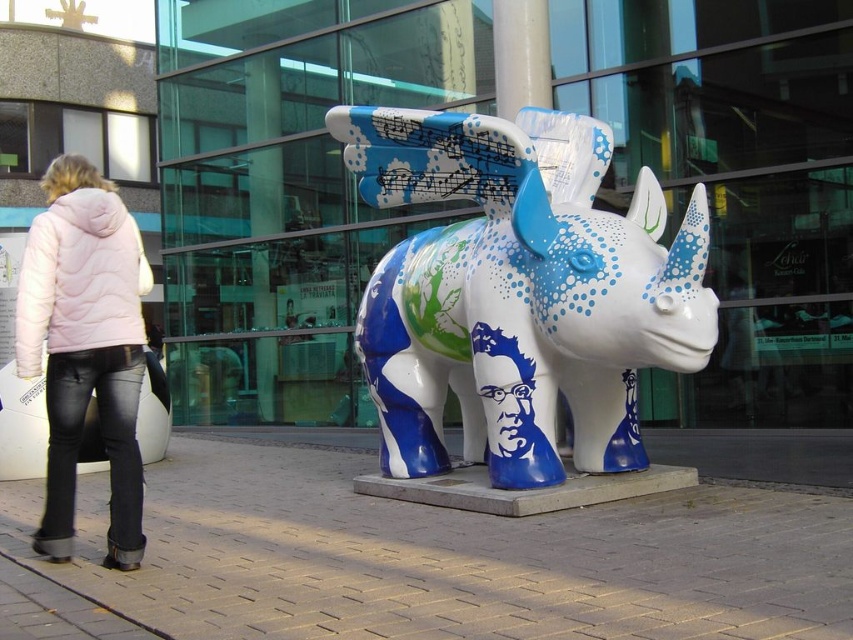
You are standing in front of the rhinoceros sculpture and want to take a photo. You notice two points marked on the sculpture. The first point is at coordinates point (519, 346) and the second is at point (93, 291). Which point will appear closer to the top edge of your camera viewfinder?

Point (519, 346) is further to the camera than point (93, 291), so it will appear closer to the top edge of your camera viewfinder.